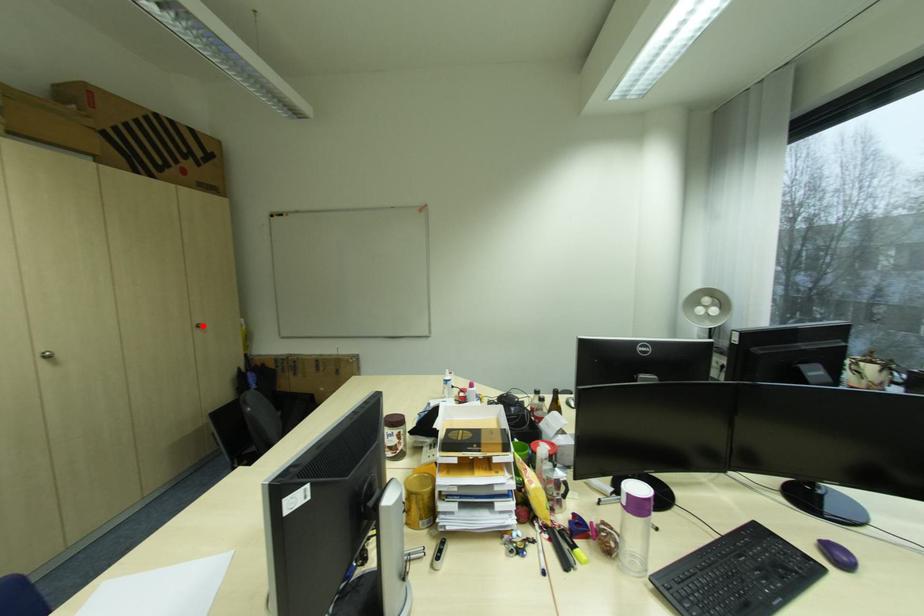
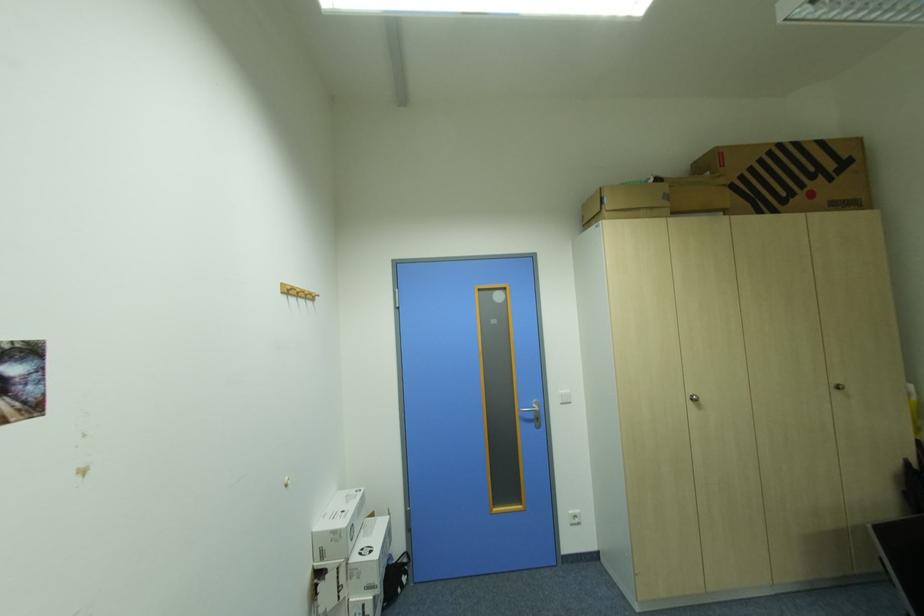
Question: I am providing you with two images of the same scene from different viewpoints. Given a red point in image1, look at the same physical point in image2. Is it:

Choices:
 (A) Closer to the viewpoint
 (B) Farther from the viewpoint

Answer: (A)